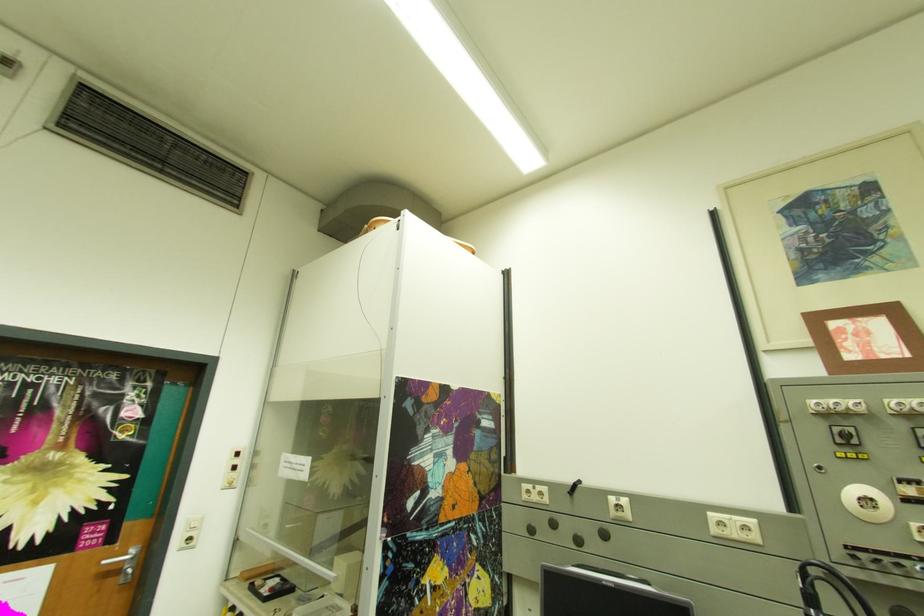
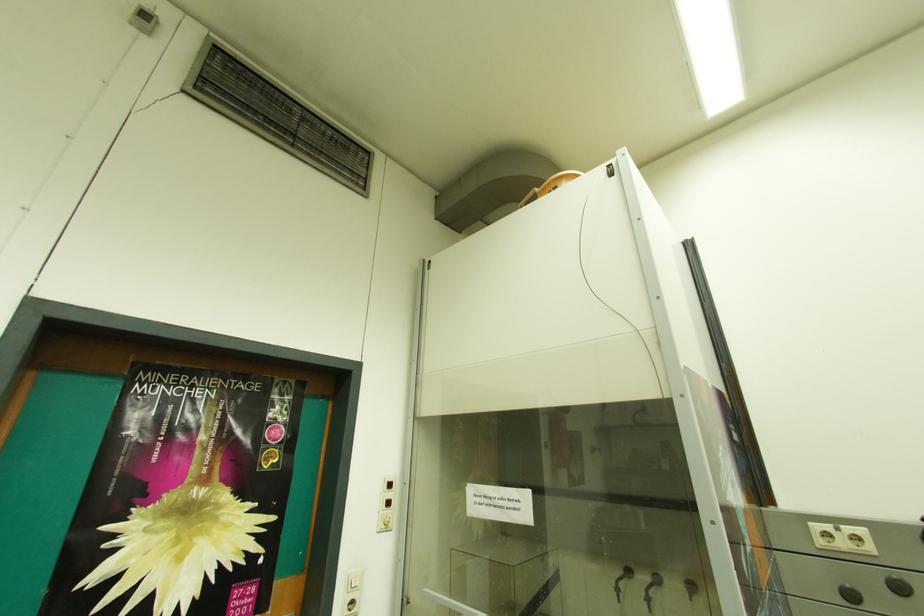
Question: I am providing you with two images of the same scene from different viewpoints. Please identify which objects are invisible in image2.

Choices:
 (A) fume hood sash
 (B) black round button
 (C) white power outlet
 (D) none of these

Answer: (D)